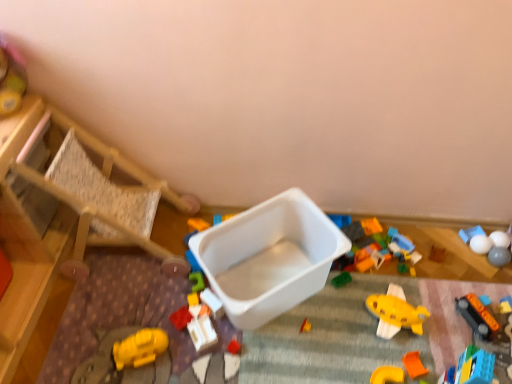
Where is `free space in front of yellow matte airplane at center, which appears as the 7th toy when viewed from the left`? free space in front of yellow matte airplane at center, which appears as the 7th toy when viewed from the left is located at coordinates (398, 365).